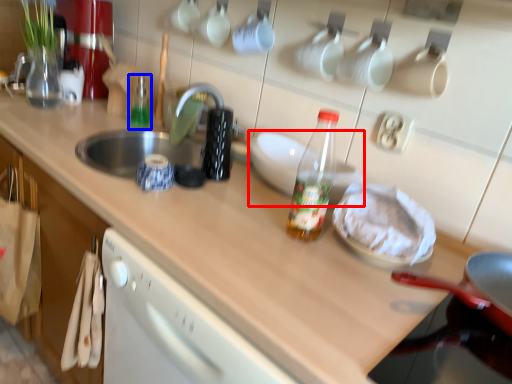
Question: Which object appears farthest to the camera in this image, appliance (highlighted by a red box) or bottle (highlighted by a blue box)?

Choices:
 (A) appliance
 (B) bottle

Answer: (B)